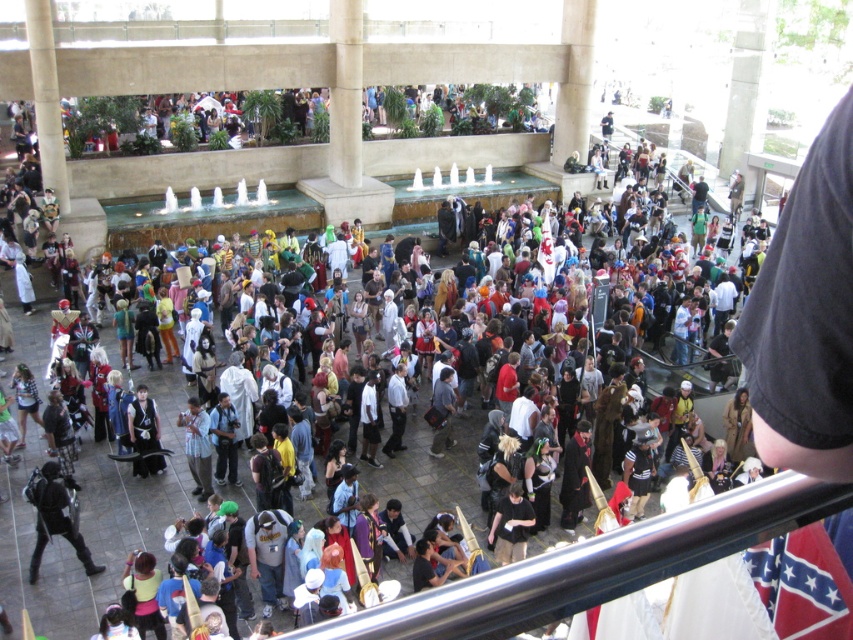
Question: Does black matte backpack at lower left appear on the left side of black leather jacket at center?

Choices:
 (A) yes
 (B) no

Answer: (A)

Question: Does black matte backpack at lower left lie in front of black leather jacket at center?

Choices:
 (A) no
 (B) yes

Answer: (B)

Question: Which of the following is the farthest from the observer?

Choices:
 (A) black leather jacket at center
 (B) black matte backpack at lower left

Answer: (A)

Question: Is black matte backpack at lower left in front of black leather jacket at center?

Choices:
 (A) no
 (B) yes

Answer: (B)

Question: Among these points, which one is nearest to the camera?

Choices:
 (A) (128, 416)
 (B) (44, 474)

Answer: (B)